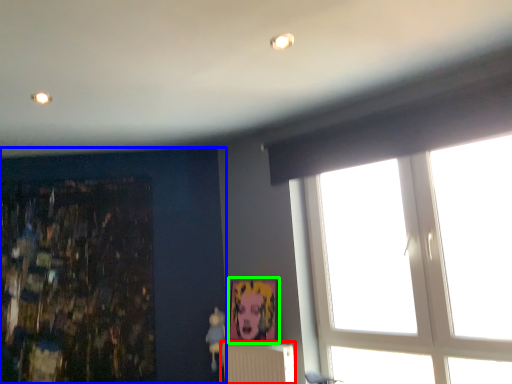
Question: Which object is the closest to the radiator (highlighted by a red box)? Choose among these: backdrop (highlighted by a blue box) or picture frame (highlighted by a green box).

Choices:
 (A) backdrop
 (B) picture frame

Answer: (B)